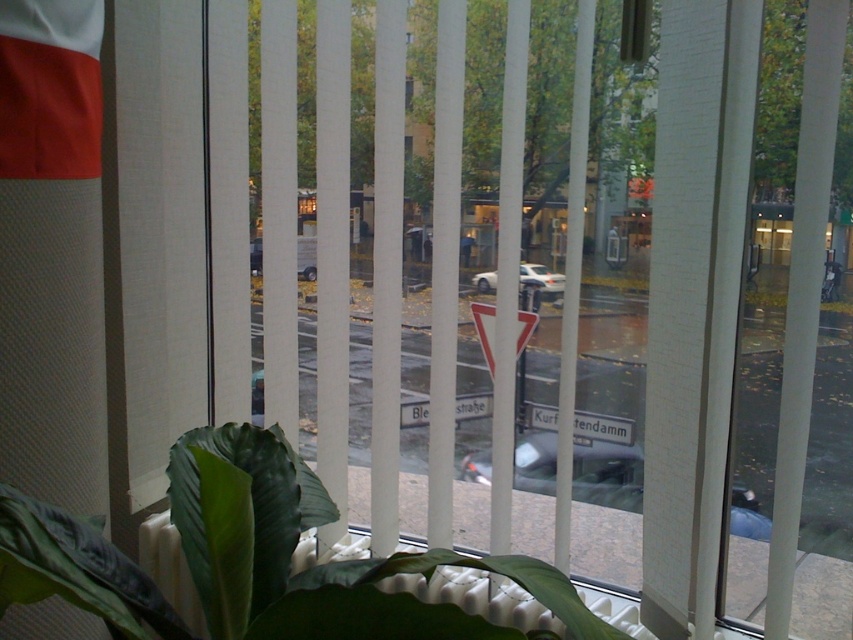
You are a delivery person trying to determine if the green matte leafy plant at lower center can fit under the metallic silver car at center without touching the car. Based on their heights, can the plant be placed there safely?

The green matte leafy plant at lower center is not as tall as the metallic silver car at center, so it can be placed under the car without touching it.

You are standing inside a room with a window covered by vertical blinds. You see a transparent glass door at right and a metallic silver car at center. Which object is positioned farther to the right?

The transparent glass door at right is positioned farther to the right than the metallic silver car at center.